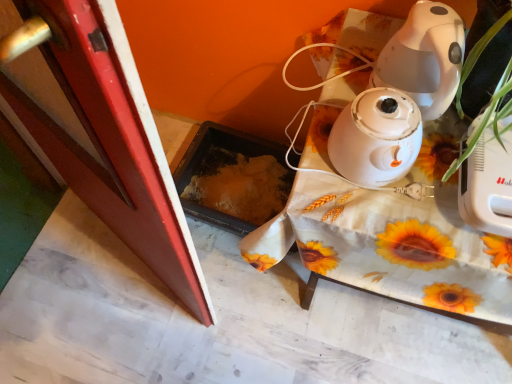
Find the location of a particular element. This screenshot has width=512, height=384. vacant area that is in front of smooth red screen door at left is located at coordinates (123, 334).